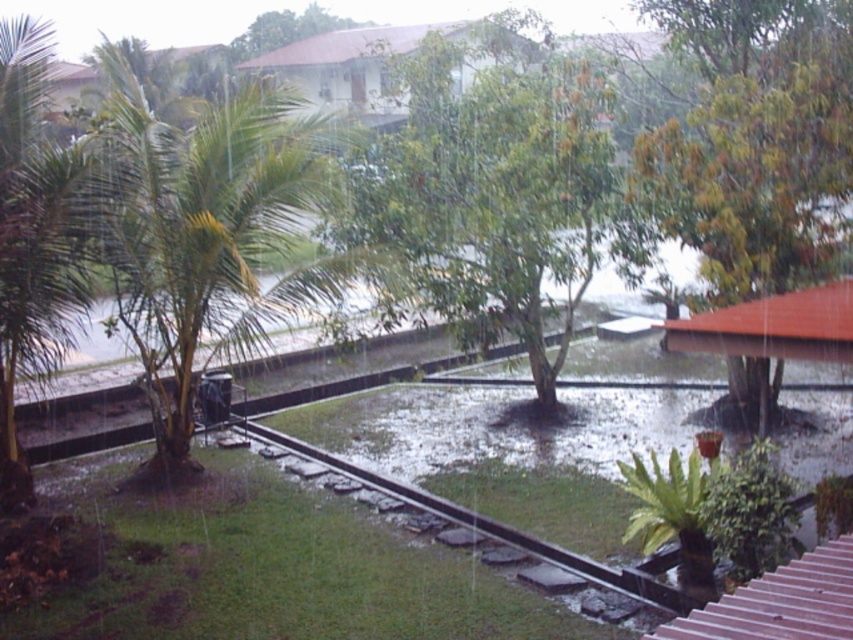
You are a gardener assessing the flooded garden. You notice the green leafy tree at center and the green leafy palm tree at left. Which tree is shorter?

The green leafy tree at center is shorter than the green leafy palm tree at left.

You are a bird looking for a place to perch. You see the green leafy palm tree at left and the black metal train track at center. Which one is taller and would allow you to have a better view of the flooded garden bed?

The green leafy palm tree at left is taller than the black metal train track at center, so perching there would give a better view of the flooded garden bed.

You are standing at the point marked by the coordinates point (485, 212) in a flooded residential area. You need to walk to a safe location that is 50 feet away from your current position. Is the distance from your current location to the nearest safe area sufficient for you to reach safety?

The distance between point (485, 212) and the viewer is 38.49 feet. Since the required safe distance is 50 feet, the current distance is insufficient to reach safety.